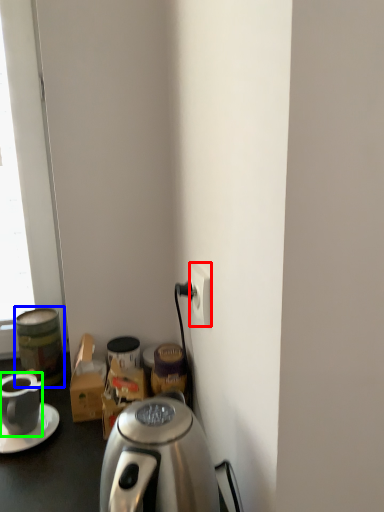
Question: Based on their relative distances, which object is nearer to power outlet (highlighted by a red box)? Choose from beverage (highlighted by a blue box) and coffee cup (highlighted by a green box).

Choices:
 (A) beverage
 (B) coffee cup

Answer: (B)